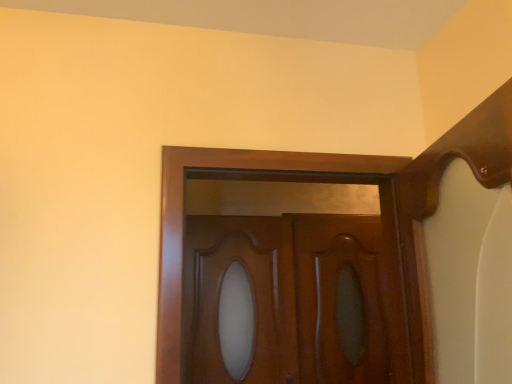
Question: From a real-world perspective, is glossy wood door at center positioned above or below glossy wood door at center?

Choices:
 (A) below
 (B) above

Answer: (A)

Question: Considering their positions, is glossy wood door at center located in front of or behind glossy wood door at center?

Choices:
 (A) front
 (B) behind

Answer: (B)

Question: Based on their relative distances, which object is farther from the glossy wood door at center?

Choices:
 (A) glossy wood door at center
 (B) glossy wood screen door at center

Answer: (B)

Question: Based on their relative distances, which object is farther from the glossy wood screen door at center?

Choices:
 (A) glossy wood door at center
 (B) glossy wood door at center

Answer: (A)